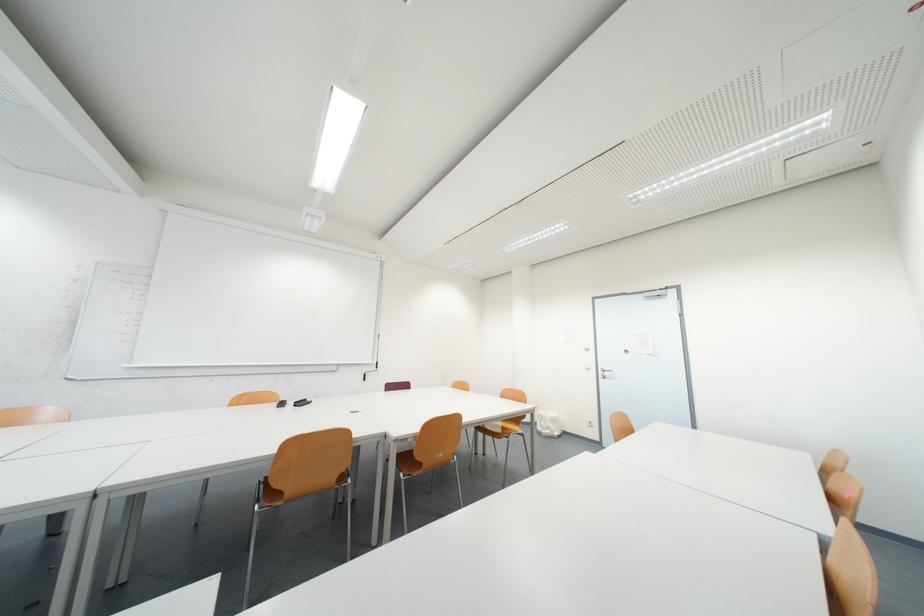
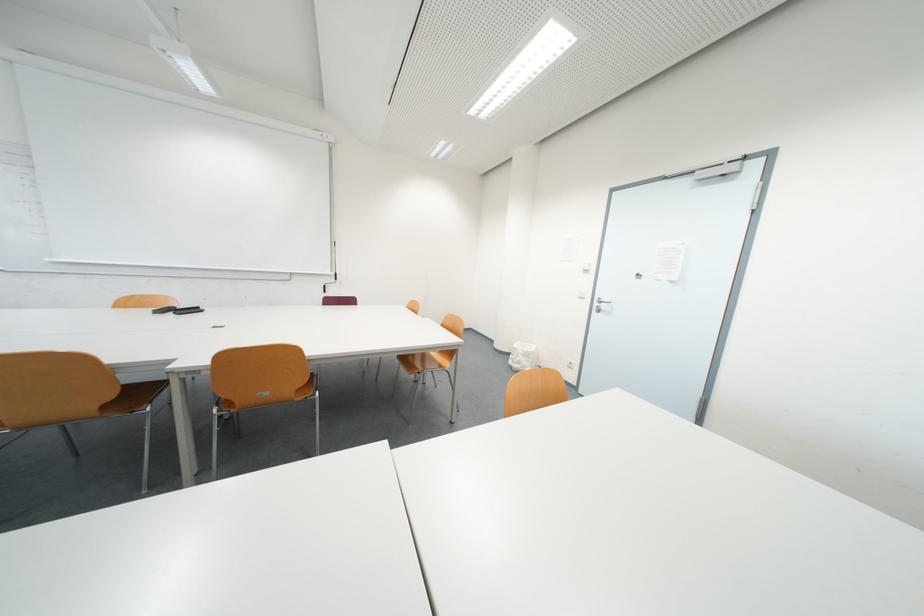
In the second image, find the point that corresponds to [611,374] in the first image.

(605, 305)